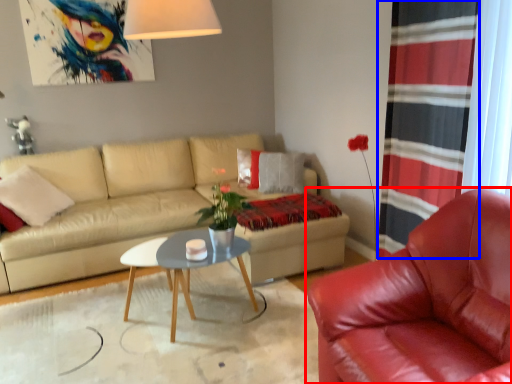
Question: Which point is further to the camera, chair (highlighted by a red box) or curtain (highlighted by a blue box)?

Choices:
 (A) chair
 (B) curtain

Answer: (B)